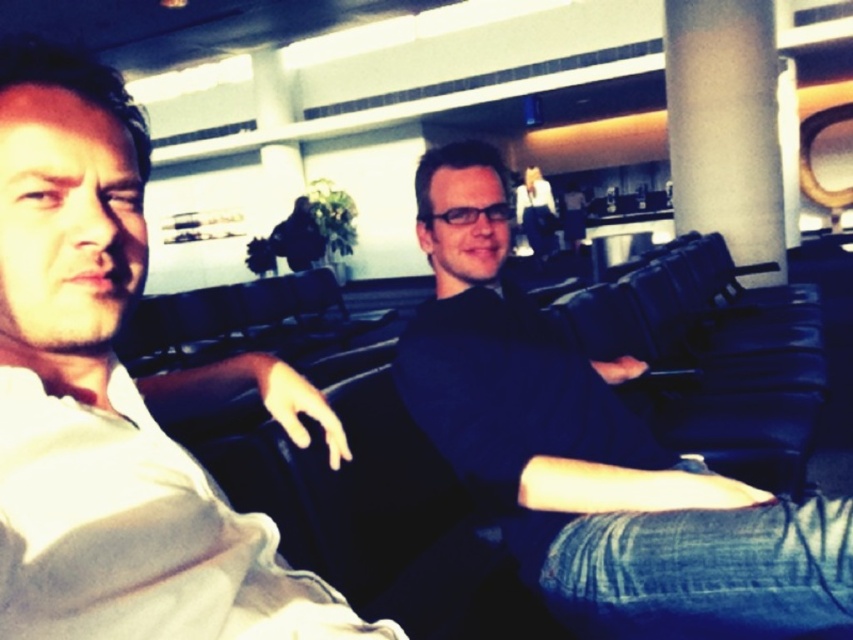
Question: Which point appears farthest from the camera in this image?

Choices:
 (A) (781, 529)
 (B) (103, 179)

Answer: (A)

Question: Based on their relative distances, which object is nearer to the white cotton shirt at left?

Choices:
 (A) white matte pillar at center
 (B) dark blue fabric at center

Answer: (B)

Question: Where is white cotton shirt at left located in relation to dark blue fabric at center in the image?

Choices:
 (A) left
 (B) right

Answer: (A)

Question: Observing the image, what is the correct spatial positioning of dark blue fabric at center in reference to white matte pillar at center?

Choices:
 (A) right
 (B) left

Answer: (B)

Question: Does dark blue fabric at center appear under white matte pillar at center?

Choices:
 (A) no
 (B) yes

Answer: (B)

Question: Which of the following is the closest to the observer?

Choices:
 (A) white cotton shirt at left
 (B) white matte pillar at center
 (C) dark blue fabric at center

Answer: (A)